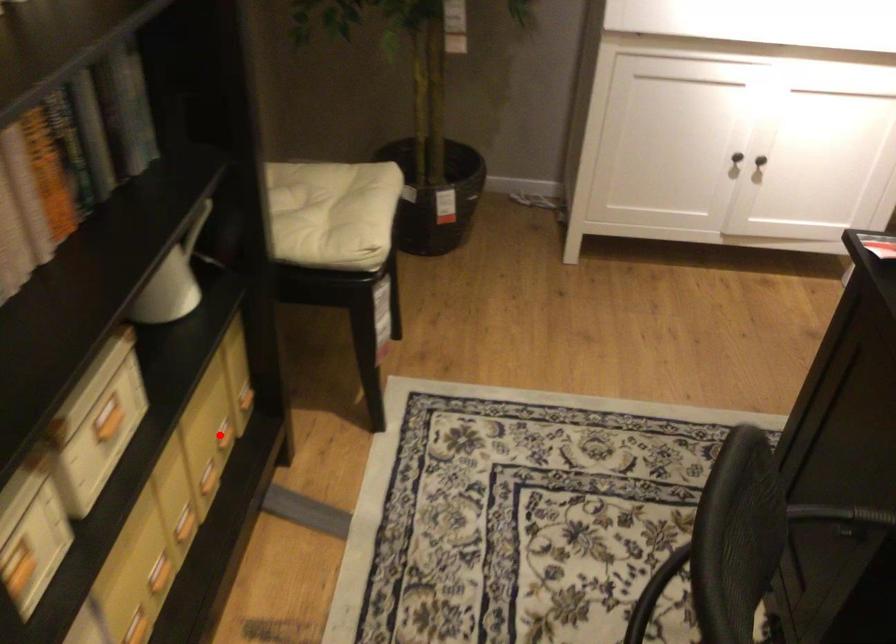
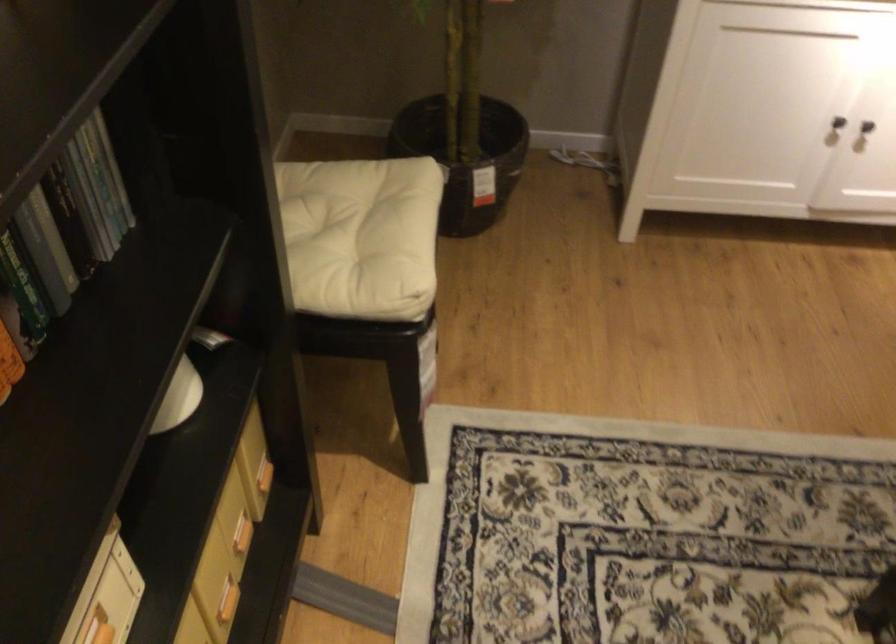
In the second image, find the point that corresponds to the highlighted location in the first image.

(240, 534)